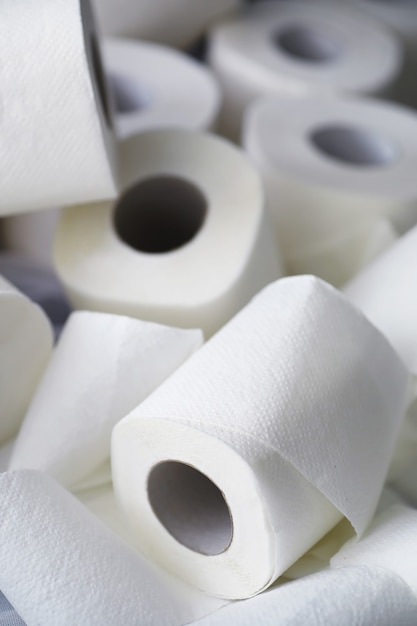
Identify the location of toilet paper. This screenshot has width=417, height=626. (288, 525), (165, 238), (340, 156), (324, 59), (151, 84), (61, 53), (161, 18), (17, 347).